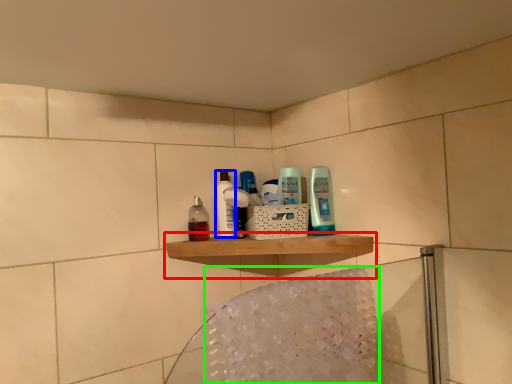
Question: Which object is positioned farthest from shelf (highlighted by a red box)? Select from toiletry (highlighted by a blue box) and bath towel (highlighted by a green box).

Choices:
 (A) toiletry
 (B) bath towel

Answer: (B)